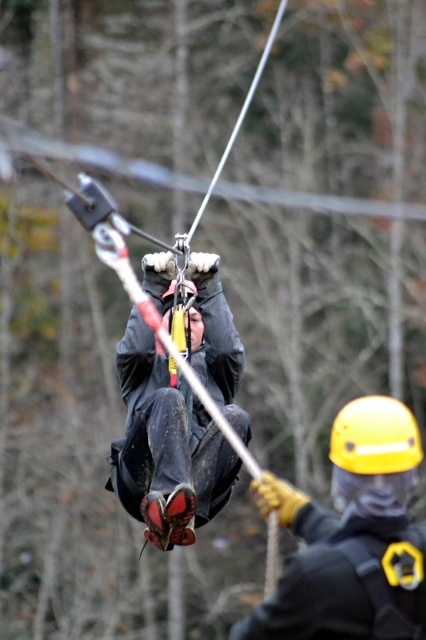
Looking at this image, can you confirm if yellow hard hat at center is positioned below matte black jacket at center?

Yes.

Who is more distant from viewer, (x=374, y=477) or (x=138, y=388)?

Positioned behind is point (x=138, y=388).

Measure the distance between point (x=348, y=467) and camera.

Point (x=348, y=467) is 7.94 meters from camera.

Image resolution: width=426 pixels, height=640 pixels. I want to click on yellow hard hat at center, so click(351, 538).